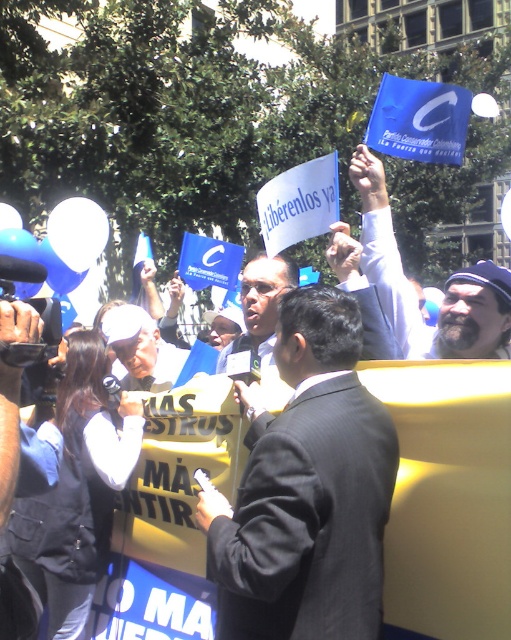
Question: Which of the following is the closest to the observer?

Choices:
 (A) (84, 552)
 (B) (288, 300)
 (C) (419, 353)

Answer: (B)

Question: Can you confirm if black fabric vest at center is positioned above blue fabric flag at upper right?

Choices:
 (A) no
 (B) yes

Answer: (A)

Question: Which of the following is the farthest from the observer?

Choices:
 (A) black fabric vest at center
 (B) dark gray suit at center

Answer: (A)

Question: Can you confirm if dark gray suit at center is positioned below black fabric vest at center?

Choices:
 (A) no
 (B) yes

Answer: (A)

Question: In this image, where is dark gray suit at center located relative to blue fabric flag at upper right?

Choices:
 (A) below
 (B) above

Answer: (A)

Question: Which point is farther to the camera?

Choices:
 (A) click(352, 342)
 (B) click(381, 192)
 (C) click(66, 529)

Answer: (B)